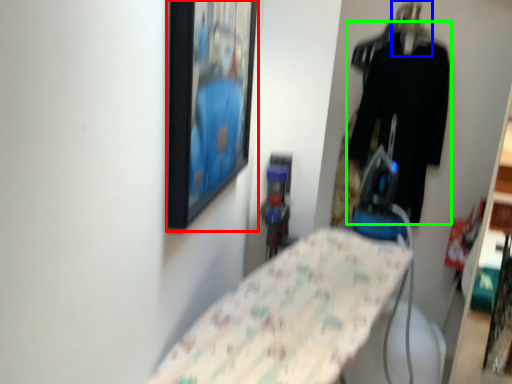
Question: Which is farther away from picture frame (highlighted by a red box)? hanger (highlighted by a blue box) or clothing (highlighted by a green box)?

Choices:
 (A) hanger
 (B) clothing

Answer: (A)